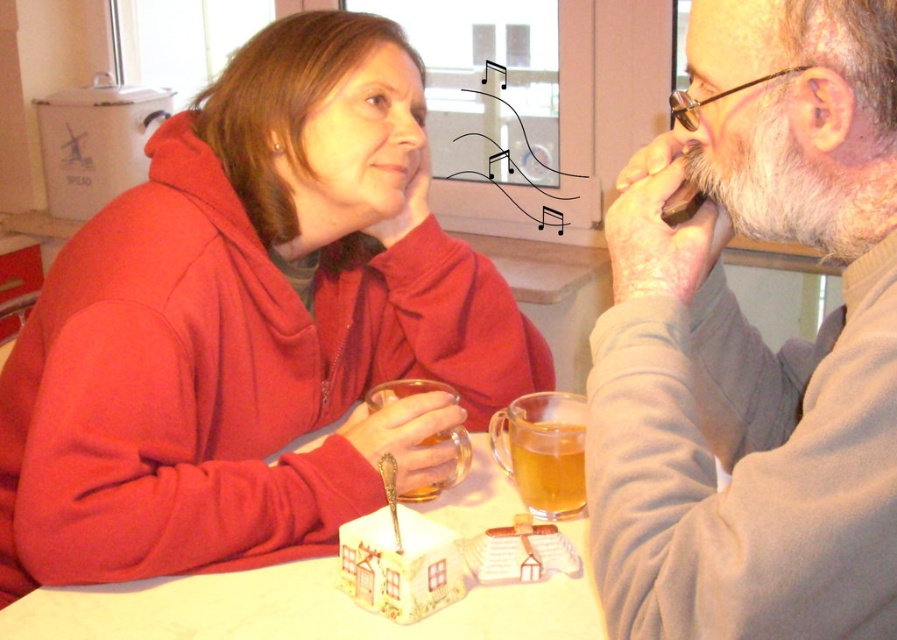
Question: Observing the image, what is the correct spatial positioning of matte red hoodie at center in reference to gray matte sweater at right?

Choices:
 (A) left
 (B) right

Answer: (A)

Question: Can you confirm if gray matte sweater at right is positioned to the right of white glossy table at center?

Choices:
 (A) yes
 (B) no

Answer: (A)

Question: Is matte red hoodie at center in front of white glossy table at center?

Choices:
 (A) no
 (B) yes

Answer: (A)

Question: Which of the following is the closest to the observer?

Choices:
 (A) (626, 205)
 (B) (288, 333)
 (C) (582, 490)

Answer: (A)

Question: Which point is closer to the camera taking this photo?

Choices:
 (A) (249, 355)
 (B) (529, 449)
 (C) (64, 625)
 (D) (806, 620)

Answer: (D)

Question: Estimate the real-world distances between objects in this image. Which object is closer to the translucent amber liquid at lower center?

Choices:
 (A) matte red hoodie at center
 (B) white glossy table at center

Answer: (B)